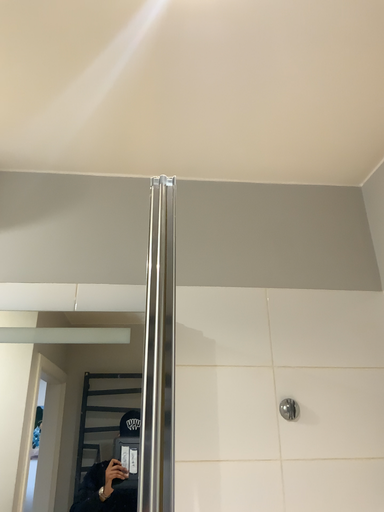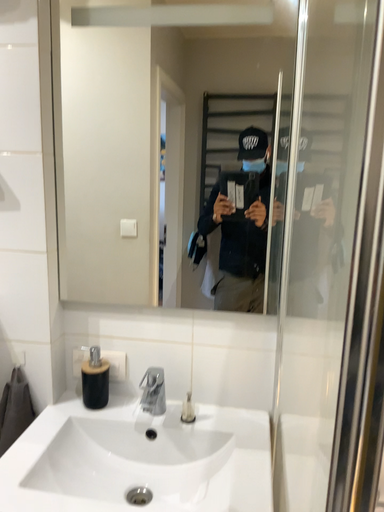
Question: Which way did the camera rotate in the video?

Choices:
 (A) rotated right
 (B) rotated left

Answer: (B)